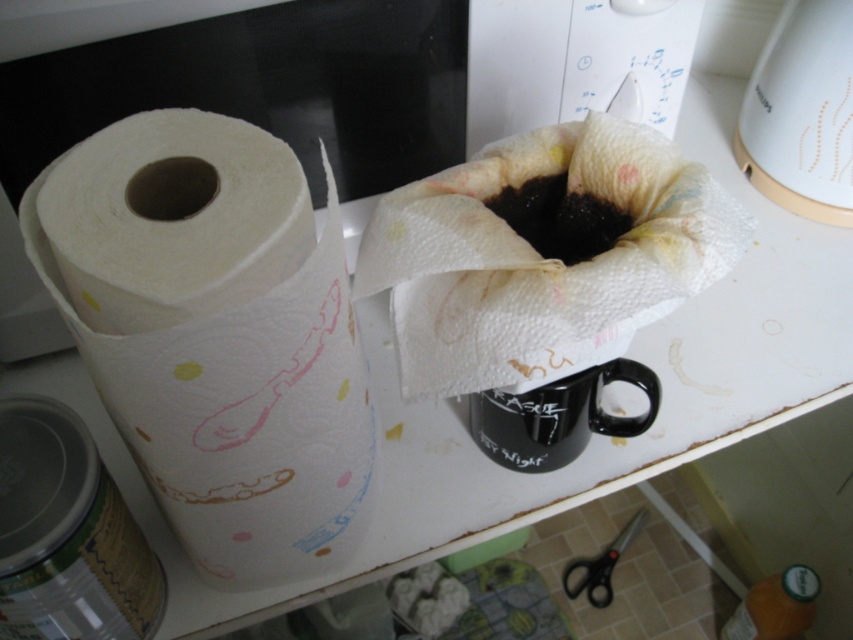
You are organizing the kitchen counter and need to place a new item between the black matte coffee at center and the black plastic scissors at lower center. Is there enough vertical space between them to fit a 2 cm thick book?

The black matte coffee at center is above the black plastic scissors at lower center, so there is vertical space between them. Since the book is only 2 cm thick, it should fit vertically between them.